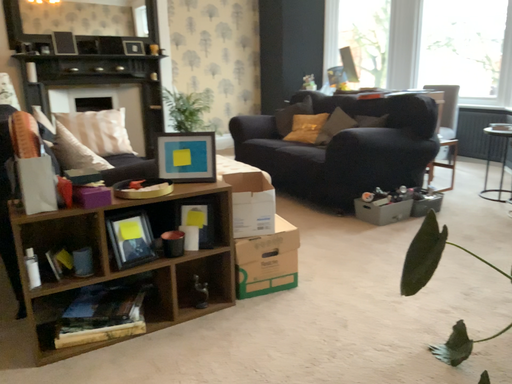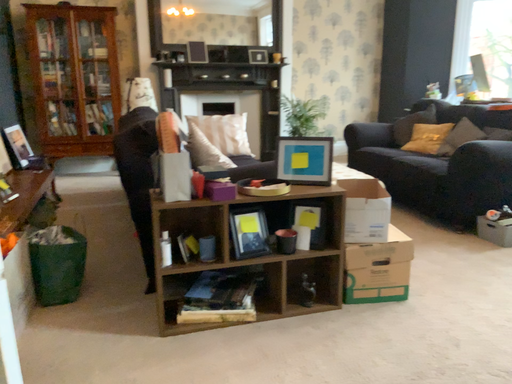
Question: How did the camera likely rotate when shooting the video?

Choices:
 (A) rotated right
 (B) rotated left

Answer: (B)